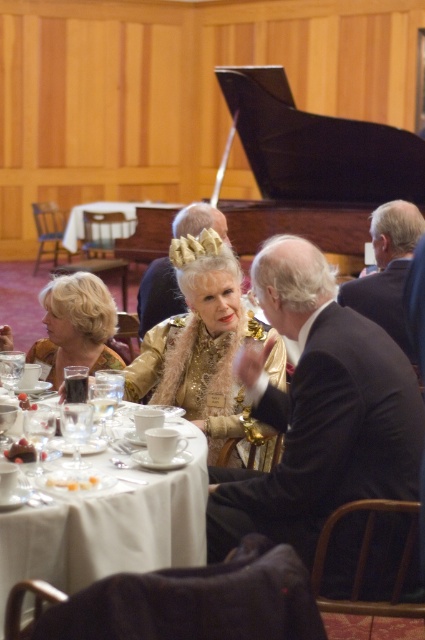
Question: Which is farther from the dark suit at center?

Choices:
 (A) blonde hair at center
 (B) gold textured crown at center
 (C) white porcelain cup at center

Answer: (B)

Question: Which is nearer to the white cloth table at center?

Choices:
 (A) dark suit at right
 (B) gold textured crown at center
 (C) blonde hair at center

Answer: (C)

Question: Which point is closer to the camera?

Choices:
 (A) (190, 536)
 (B) (17, 449)
 (C) (57, 364)

Answer: (B)

Question: Does blonde hair at center appear under smooth white cream at lower left?

Choices:
 (A) yes
 (B) no

Answer: (B)

Question: Considering the relative positions of white porcelain cup at center and chocolate cake at table center in the image provided, where is white porcelain cup at center located with respect to chocolate cake at table center?

Choices:
 (A) above
 (B) below

Answer: (B)

Question: Is white porcelain cup at center above smooth white cream at lower left?

Choices:
 (A) no
 (B) yes

Answer: (B)